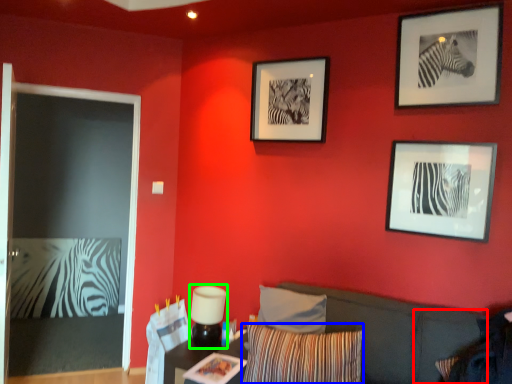
Question: Which object is the farthest from pillow (highlighted by a red box)? Choose among these: pillow (highlighted by a blue box) or lamp (highlighted by a green box).

Choices:
 (A) pillow
 (B) lamp

Answer: (B)